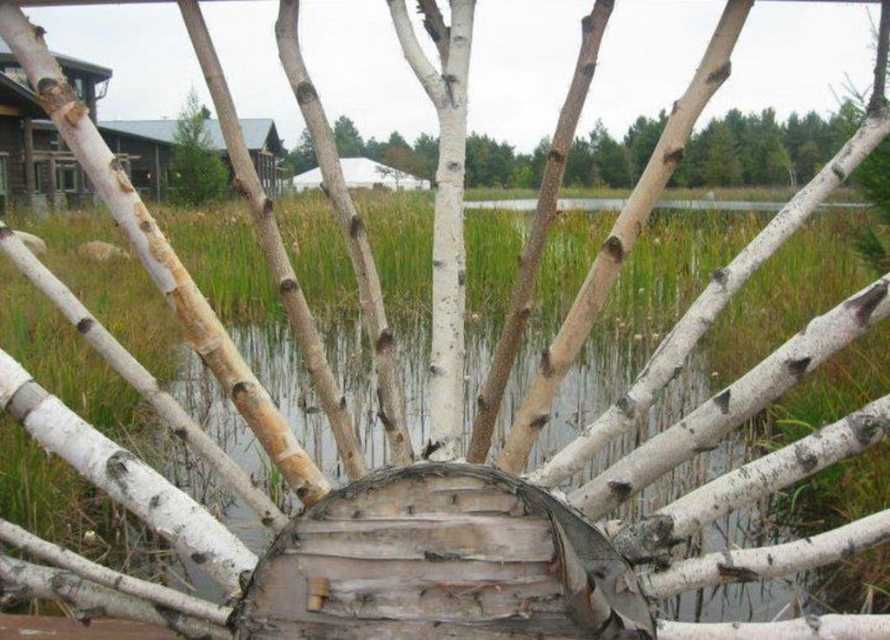
You are an outdoor enthusiast planning to take a photo of the wooden cabin at upper left and the green textured pine tree at upper left. Based on their positions, which object should you place on the left side of your photo to capture both in the frame?

The wooden cabin at upper left should be placed on the left side of your photo because it is positioned to the left of the green textured pine tree at upper left.

You are an architect designing a new eco lodge and are inspired by the wooden cabin at upper left and the green textured pine tree at upper left in the image. Which of these two objects has a smaller width in the scene?

The wooden cabin at upper left has a lesser width compared to the green textured pine tree at upper left, so the wooden cabin at upper left is smaller in width.